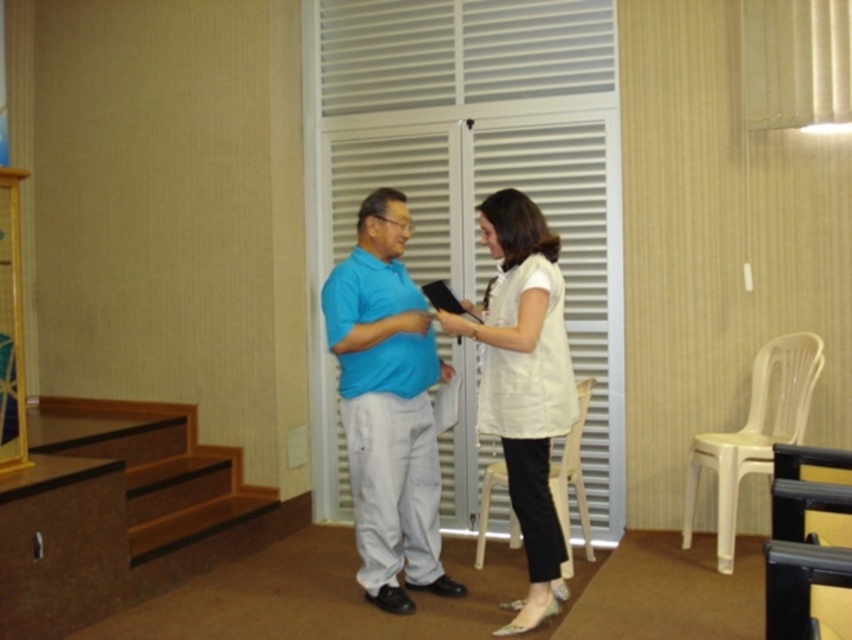
Question: Where is white fabric dress at center located in relation to brown wood stairs at lower left in the image?

Choices:
 (A) above
 (B) below

Answer: (A)

Question: Is white fabric dress at center behind white plastic chair at center?

Choices:
 (A) no
 (B) yes

Answer: (A)

Question: Which of the following is the closest to the observer?

Choices:
 (A) (213, 516)
 (B) (799, 381)
 (C) (407, 550)
 (D) (516, 292)

Answer: (D)

Question: Is brown wood stairs at lower left positioned behind white plastic chair at right?

Choices:
 (A) no
 (B) yes

Answer: (B)

Question: Considering the real-world distances, which object is closest to the white plastic chair at center?

Choices:
 (A) matte blue shirt at center
 (B) white fabric dress at center
 (C) white plastic chair at right

Answer: (B)

Question: Which point is farther from the camera taking this photo?

Choices:
 (A) (521, 403)
 (B) (478, 554)

Answer: (B)